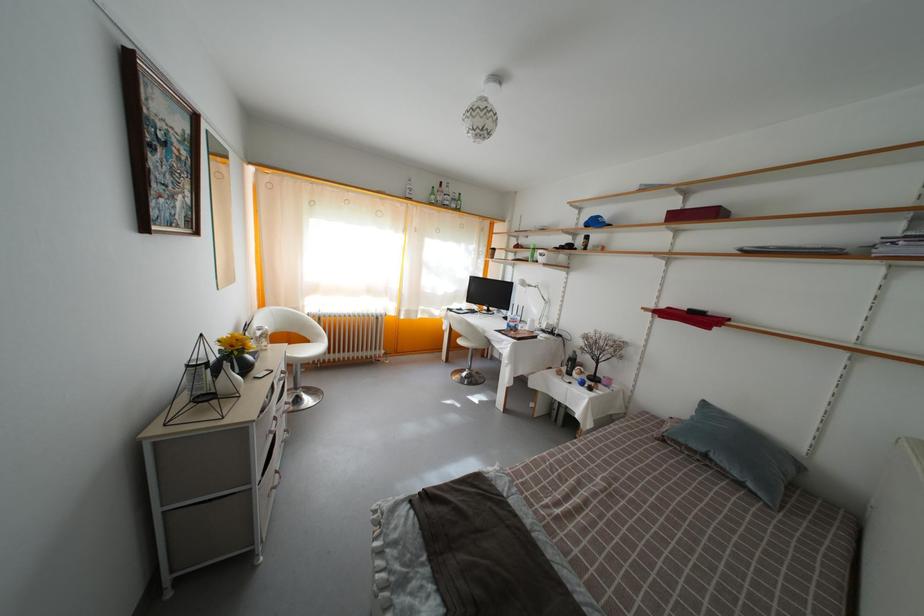
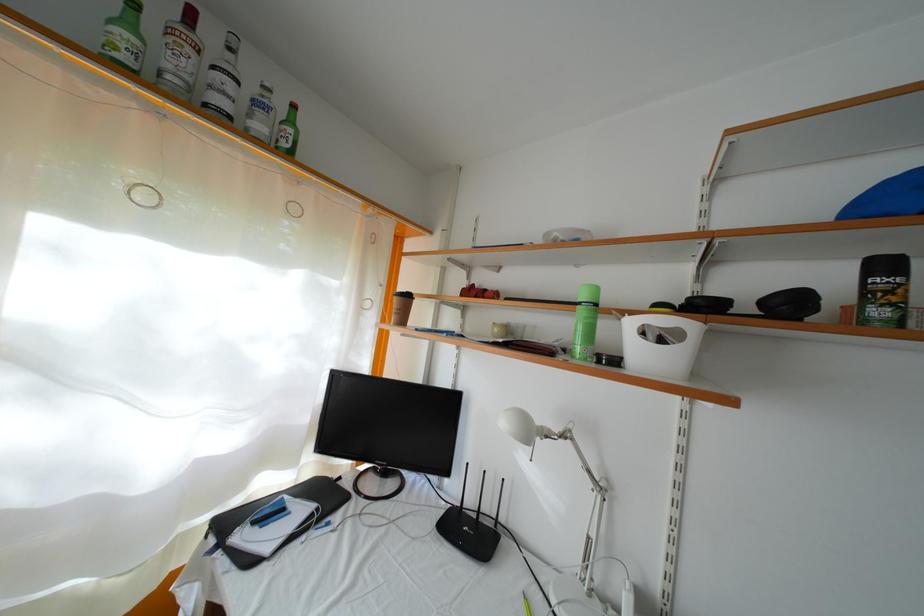
Find the pixel in the second image that matches [529,290] in the first image.

(535, 439)